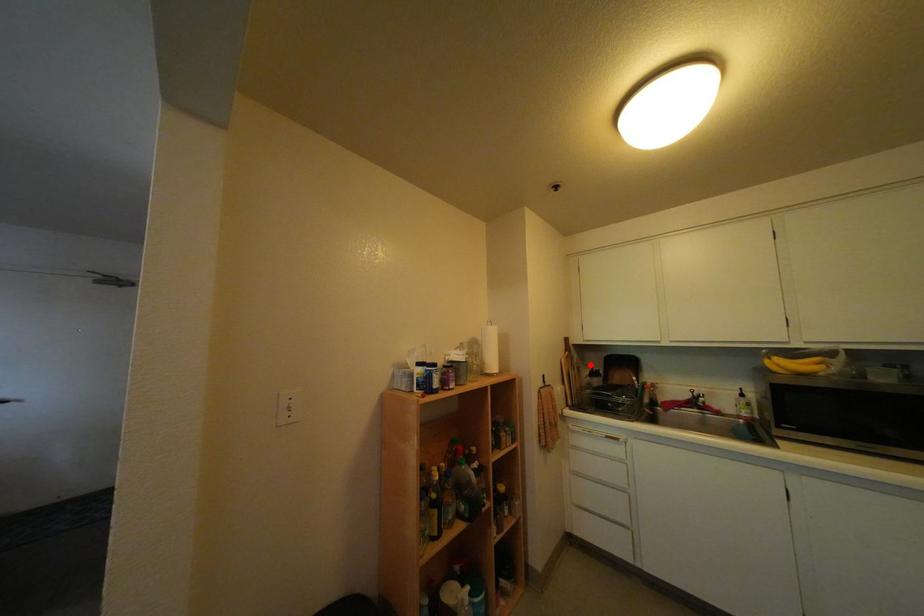
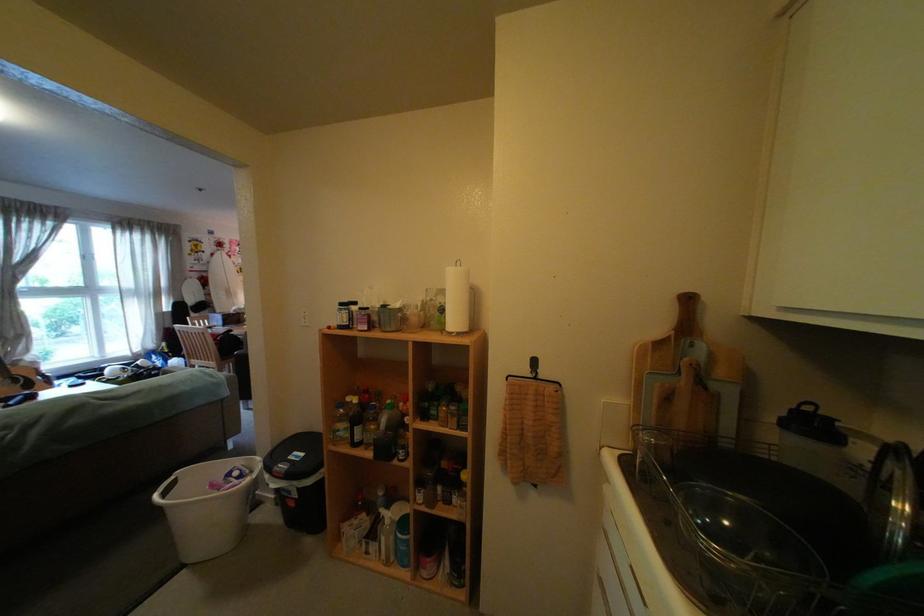
In the second image, find the point that corresponds to the highlighted location in the first image.

(704, 367)